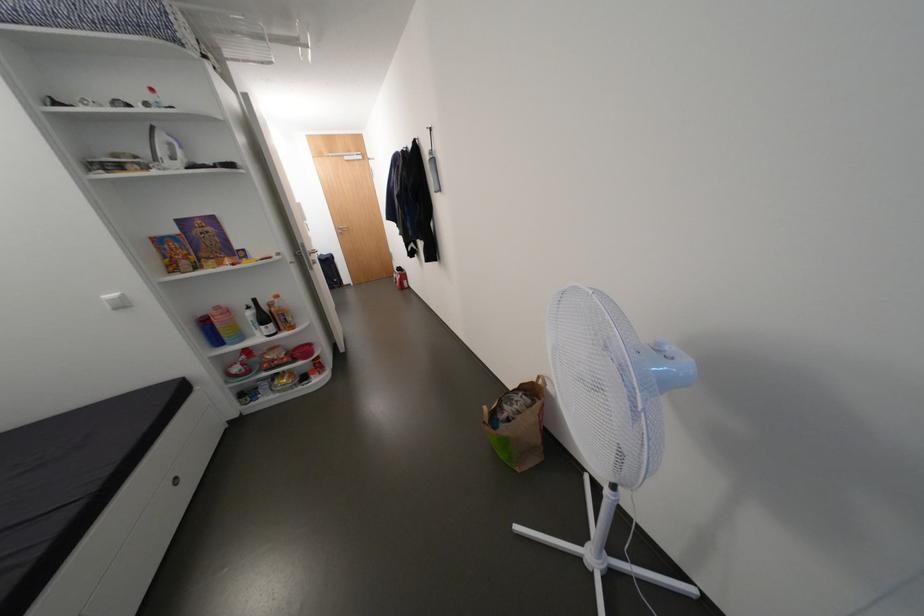
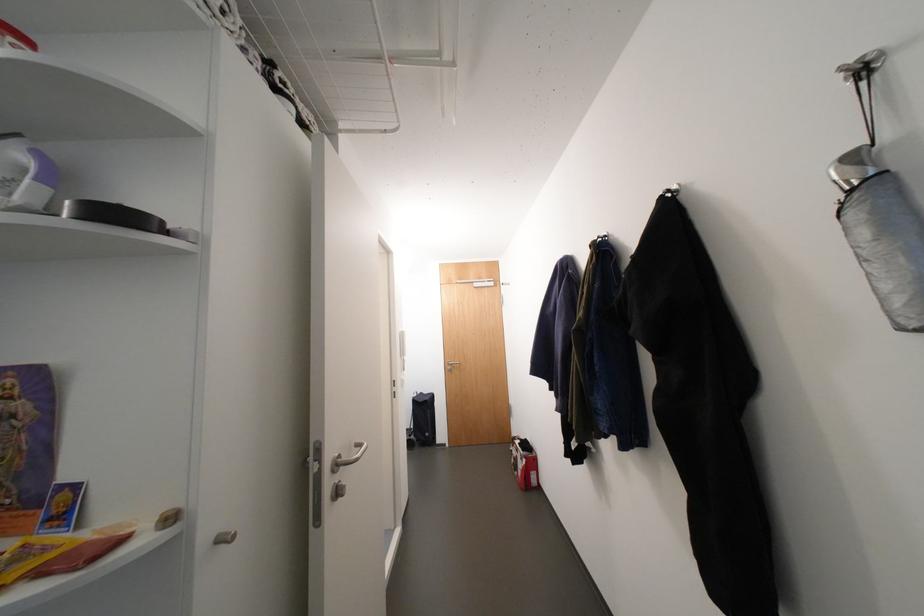
In the second image, find the point that corresponds to (406,284) in the first image.

(527, 474)